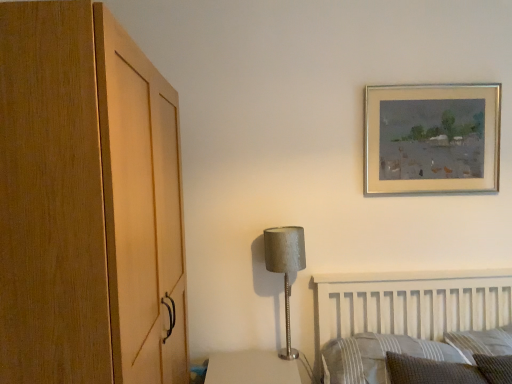
Question: Does woven fabric pillow at lower right, positioned as the 2th pillow in right-to-left order, have a greater height compared to textured gray pillow at lower right, the 3th pillow in the left-to-right sequence?

Choices:
 (A) no
 (B) yes

Answer: (A)

Question: Can you confirm if woven fabric pillow at lower right, positioned as the 2th pillow in right-to-left order, is bigger than textured gray pillow at lower right, the 3th pillow in the left-to-right sequence?

Choices:
 (A) yes
 (B) no

Answer: (B)

Question: Is woven fabric pillow at lower right, positioned as the 2th pillow in right-to-left order, positioned with its back to textured gray pillow at lower right, the 1th pillow positioned from the right?

Choices:
 (A) yes
 (B) no

Answer: (B)

Question: From a real-world perspective, is woven fabric pillow at lower right, positioned as the 2th pillow in right-to-left order, under textured gray pillow at lower right, the 3th pillow in the left-to-right sequence?

Choices:
 (A) no
 (B) yes

Answer: (B)

Question: Does woven fabric pillow at lower right, positioned as the 2th pillow in right-to-left order, have a greater width compared to textured gray pillow at lower right, the 3th pillow in the left-to-right sequence?

Choices:
 (A) yes
 (B) no

Answer: (B)

Question: Is satin silver lamp at center to the left or to the right of woven fabric pillow at lower right, placed as the 2th pillow when sorted from left to right, in the image?

Choices:
 (A) left
 (B) right

Answer: (A)

Question: From a real-world perspective, is satin silver lamp at center positioned above or below woven fabric pillow at lower right, positioned as the 2th pillow in right-to-left order?

Choices:
 (A) above
 (B) below

Answer: (A)

Question: In terms of width, does satin silver lamp at center look wider or thinner when compared to woven fabric pillow at lower right, positioned as the 2th pillow in right-to-left order?

Choices:
 (A) thin
 (B) wide

Answer: (A)

Question: Is point (286, 256) positioned closer to the camera than point (472, 374)?

Choices:
 (A) farther
 (B) closer

Answer: (A)

Question: Is striped fabric pillow at lower right, the 3th pillow from the right, bigger or smaller than satin silver lamp at center?

Choices:
 (A) small
 (B) big

Answer: (B)

Question: From a real-world perspective, is striped fabric pillow at lower right, the 3th pillow from the right, above or below satin silver lamp at center?

Choices:
 (A) above
 (B) below

Answer: (B)

Question: From the image's perspective, is striped fabric pillow at lower right, positioned as the first pillow in left-to-right order, above or below satin silver lamp at center?

Choices:
 (A) above
 (B) below

Answer: (B)

Question: Is striped fabric pillow at lower right, positioned as the first pillow in left-to-right order, wider or thinner than satin silver lamp at center?

Choices:
 (A) wide
 (B) thin

Answer: (A)

Question: Considering the positions of gold metallic picture frame at upper right and satin silver lamp at center in the image, is gold metallic picture frame at upper right wider or thinner than satin silver lamp at center?

Choices:
 (A) wide
 (B) thin

Answer: (B)

Question: Is point (493, 150) positioned closer to the camera than point (286, 231)?

Choices:
 (A) closer
 (B) farther

Answer: (B)